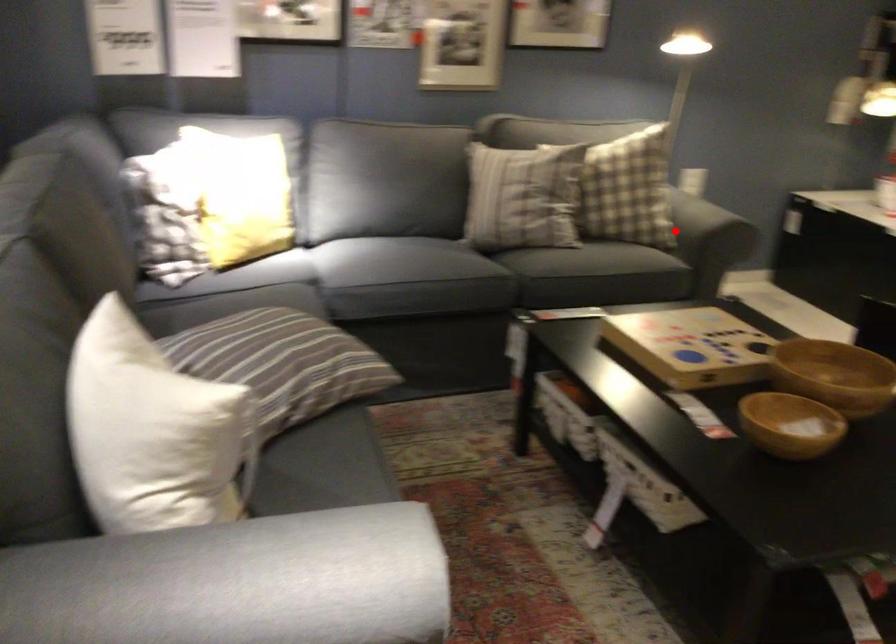
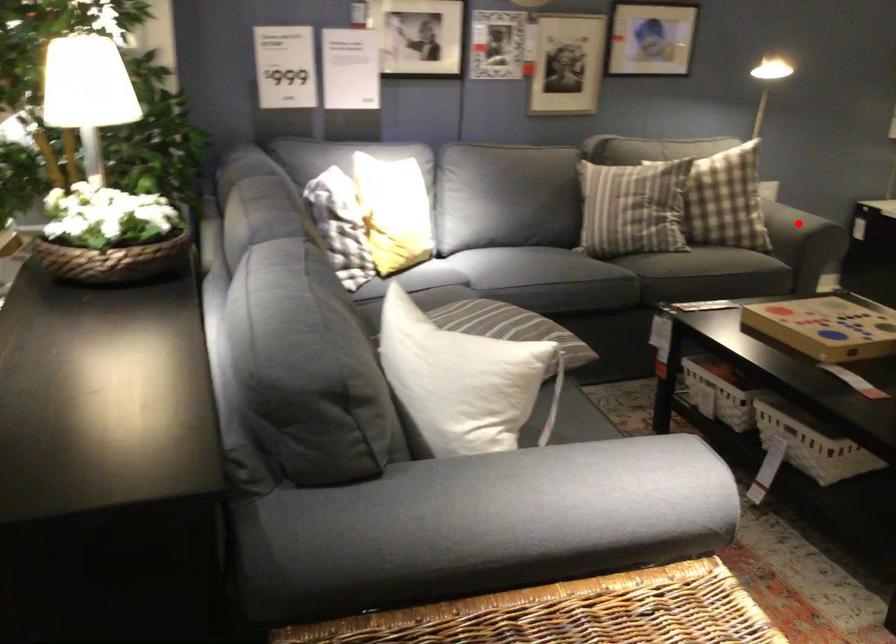
I am providing you with two images of the same scene from different viewpoints. A red point is marked on the first image and another point is marked on the second image. Are the points marked in image1 and image2 representing the same 3D position?

Yes